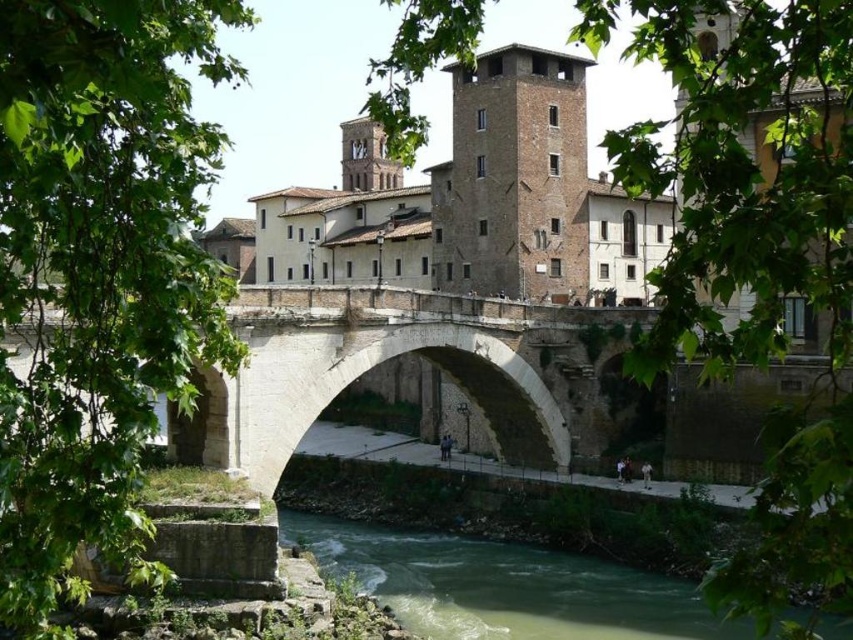
You are a tourist standing on the historic stone bridge and want to take a photo of the brown rough stone tower at center and the green stone water at lower center. Can you fit both objects in your camera frame if your camera has a maximum field of view of 30 meters?

The brown rough stone tower at center and green stone water at lower center are 32.89 meters apart from each other. Since the camera has a maximum field of view of 30 meters, the distance between them exceeds the camera capability, so they cannot be captured in a single frame.

You are an architect analyzing the historic stone bridge and its surrounding structures. You notice two brown stone towers in the image. Which of the two towers, the brown rough stone tower at center or the brown stone tower at upper center, is taller?

The brown rough stone tower at center is taller than the brown stone tower at upper center according to the description provided.

You are standing at the center of the historic stone bridge and want to locate the brown rough stone tower at center. According to the coordinates given, in which direction should you look to see the tower?

The brown rough stone stone tower at center is located at coordinates point [514,179]. Since you are standing at the center of the bridge, you should look towards the lower left direction to see the tower.